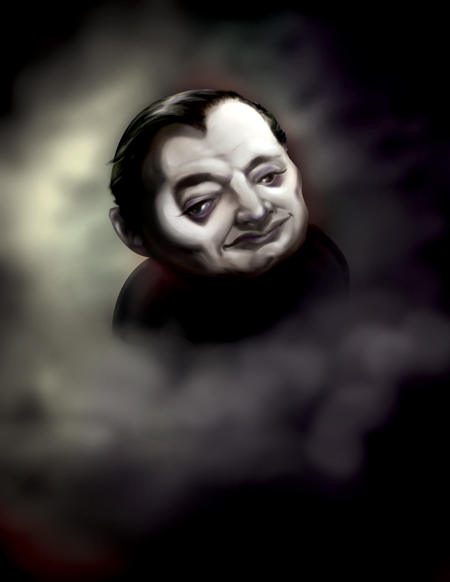
The height and width of the screenshot is (582, 450). In order to click on corner in this screenshot , I will do `click(403, 546)`.